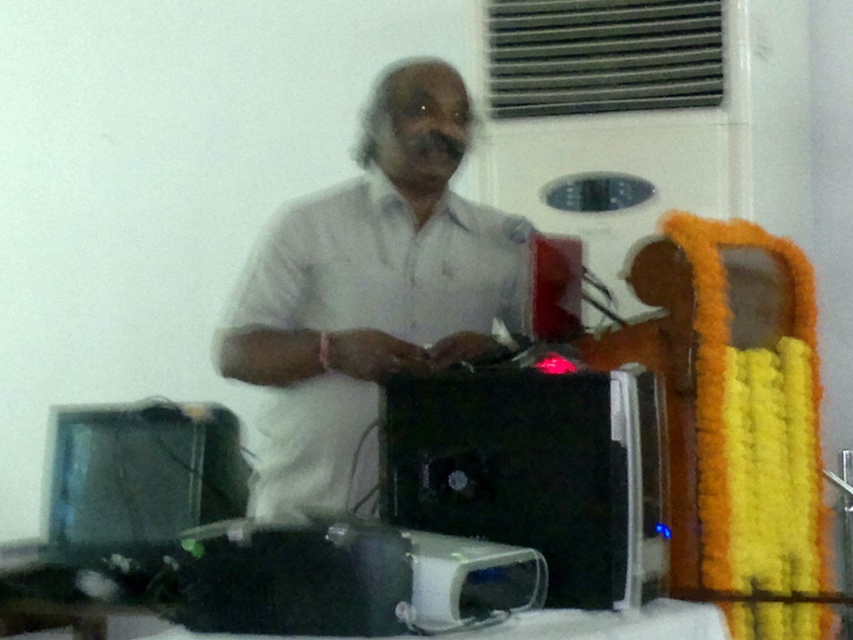
You are an event organizer setting up a presentation. You need to place a name tag on the white matte shirt at center so it is visible to the audience. Where should you position the name tag relative to the black plastic computer at lower left?

The white matte shirt at center is to the right of the black plastic computer at lower left, so place the name tag on the right side of the white matte shirt at center to ensure it is visible next to the computer.

You are a photographer adjusting your camera settings to capture the man in the scene. You notice the white matte shirt at center and the black plastic computer at center. Which object should you focus on first if you want to ensure both are in sharp focus?

You should focus on the white matte shirt at center first because it is closer to you than the black plastic computer at center, ensuring both will be in focus when using a shallow depth of field.